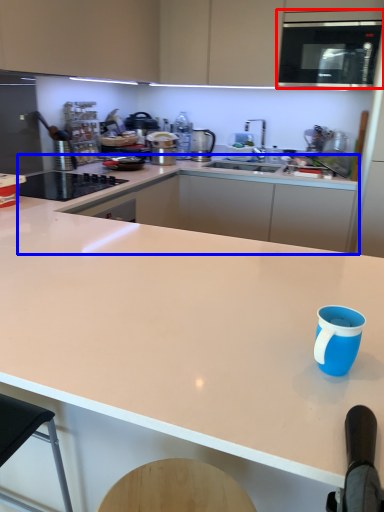
Question: Among these objects, which one is nearest to the camera, microwave oven (highlighted by a red box) or countertop (highlighted by a blue box)?

Choices:
 (A) microwave oven
 (B) countertop

Answer: (A)